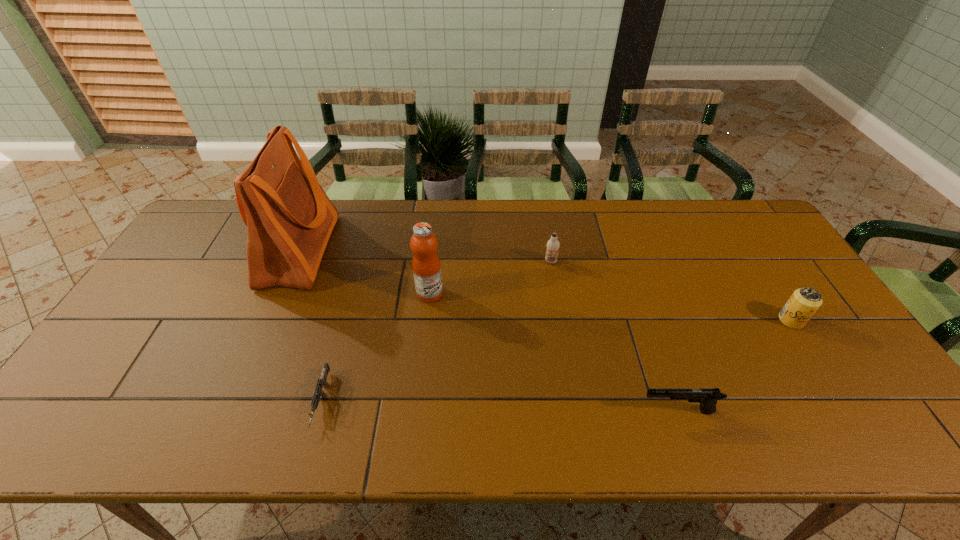
Identify the location of free space between the tallest object and the second object from left to right. The width and height of the screenshot is (960, 540). (310, 326).

Identify the location of vacant point located between the second shortest object and the tallest object. This screenshot has height=540, width=960. (489, 331).

Where is `free space between the chocolate milk and the left gun`? Image resolution: width=960 pixels, height=540 pixels. free space between the chocolate milk and the left gun is located at coordinates (436, 331).

Find the location of a particular element. free area in between the second tallest object and the fifth object from left to right is located at coordinates (554, 352).

You are a GUI agent. You are given a task and a screenshot of the screen. Output one action in this format:
    pyautogui.click(x=<x>, y=<y>)
    Task: Click on the vacant space that's between the fruit juice and the fifth object from left to right
    
    Given the screenshot: What is the action you would take?
    pyautogui.click(x=554, y=352)

Select which object appears as the fifth closest to the shortest object. Please provide its 2D coordinates. Your answer should be formatted as a tuple, i.e. [(x, y)], where the tuple contains the x and y coordinates of a point satisfying the conditions above.

[(804, 302)]

You are a GUI agent. You are given a task and a screenshot of the screen. Output one action in this format:
    pyautogui.click(x=<x>, y=<y>)
    Task: Click on the object identified as the fourth closest to the leftmost object
    The height and width of the screenshot is (540, 960).
    Given the screenshot: What is the action you would take?
    pyautogui.click(x=708, y=398)

Find the location of a particular element. vacant area in the image that satisfies the following two spatial constraints: 1. on the front pocket of the third object from right to left; 2. on the right side of the shopping bag is located at coordinates (295, 261).

Identify the location of free space that satisfies the following two spatial constraints: 1. on the front label of the third object from left to right; 2. aimed along the barrel of the fifth object from right to left. Image resolution: width=960 pixels, height=540 pixels. (418, 401).

Locate an element on the screen. vacant space that satisfies the following two spatial constraints: 1. on the front label of the fourth farthest object; 2. on the right side of the fruit juice is located at coordinates (427, 320).